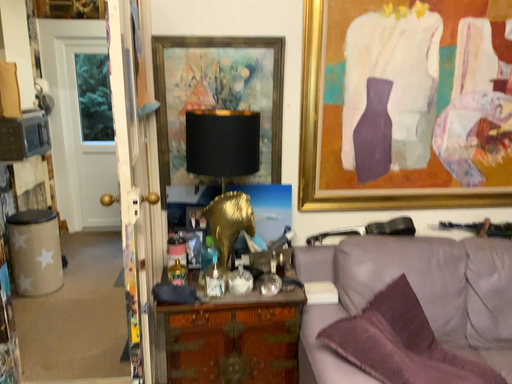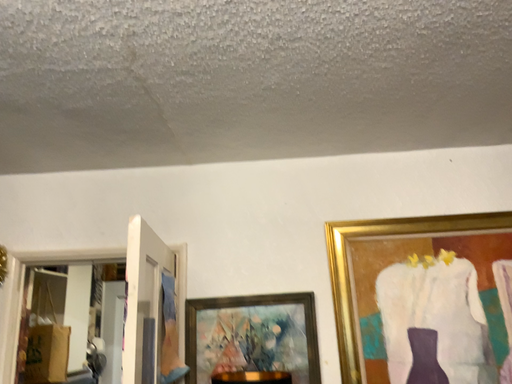
Question: Which way did the camera rotate in the video?

Choices:
 (A) rotated downward
 (B) rotated upward

Answer: (B)